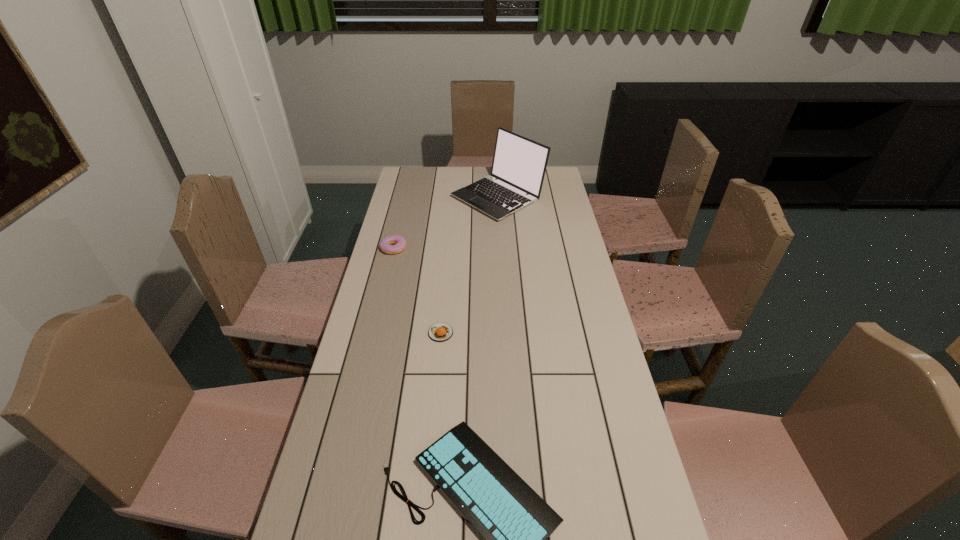
You are a GUI agent. You are given a task and a screenshot of the screen. Output one action in this format:
    pyautogui.click(x=<x>, y=<y>)
    Task: Click on the tallest object
    The width and height of the screenshot is (960, 540).
    Given the screenshot: What is the action you would take?
    pyautogui.click(x=519, y=164)

At what (x,y) coordinates should I click in order to perform the action: click on laptop_computer. Please return your answer as a coordinate pair (x, y). This screenshot has height=540, width=960. Looking at the image, I should click on (519, 164).

Find the location of a particular element. Image resolution: width=960 pixels, height=540 pixels. doughnut is located at coordinates (400, 243).

Locate an element on the screen. the leftmost object is located at coordinates (400, 243).

The image size is (960, 540). I want to click on the third farthest object, so click(440, 332).

Locate an element on the screen. The height and width of the screenshot is (540, 960). the third tallest object is located at coordinates (440, 332).

You are a GUI agent. You are given a task and a screenshot of the screen. Output one action in this format:
    pyautogui.click(x=<x>, y=<y>)
    Task: Click on the vacant space located at the front screen of the tallest object
    
    Given the screenshot: What is the action you would take?
    pyautogui.click(x=403, y=197)

Find the location of `free space located 0.050m at the front screen of the tallest object`. free space located 0.050m at the front screen of the tallest object is located at coordinates (440, 197).

Find the location of a particular element. The width and height of the screenshot is (960, 540). vacant point located 0.070m at the front screen of the tallest object is located at coordinates (435, 197).

Image resolution: width=960 pixels, height=540 pixels. I want to click on vacant space located on the front of the doughnut, so click(x=389, y=269).